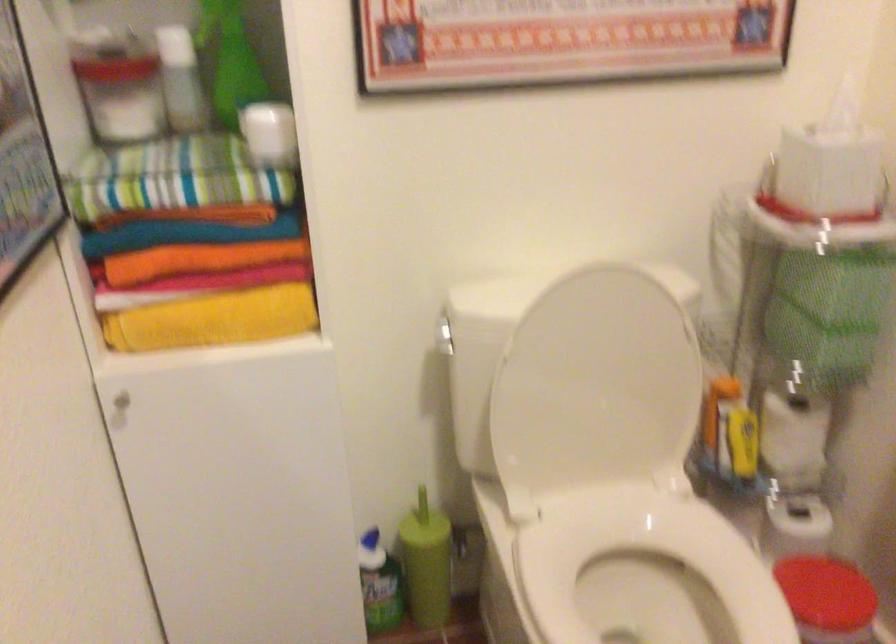
You are a GUI agent. You are given a task and a screenshot of the screen. Output one action in this format:
    pyautogui.click(x=<x>, y=<y>)
    Task: Click on the toilet flush handle
    
    Given the screenshot: What is the action you would take?
    pyautogui.click(x=444, y=336)